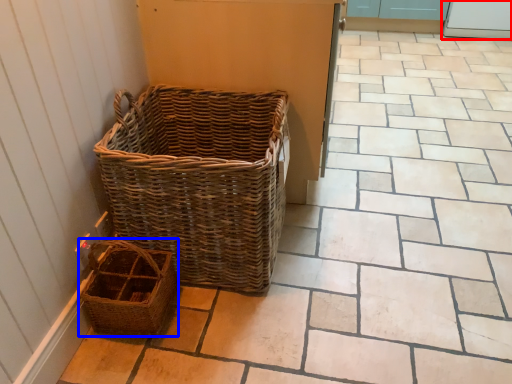
Question: Which of the following is the farthest to the observer, screen door (highlighted by a red box) or picnic basket (highlighted by a blue box)?

Choices:
 (A) screen door
 (B) picnic basket

Answer: (A)